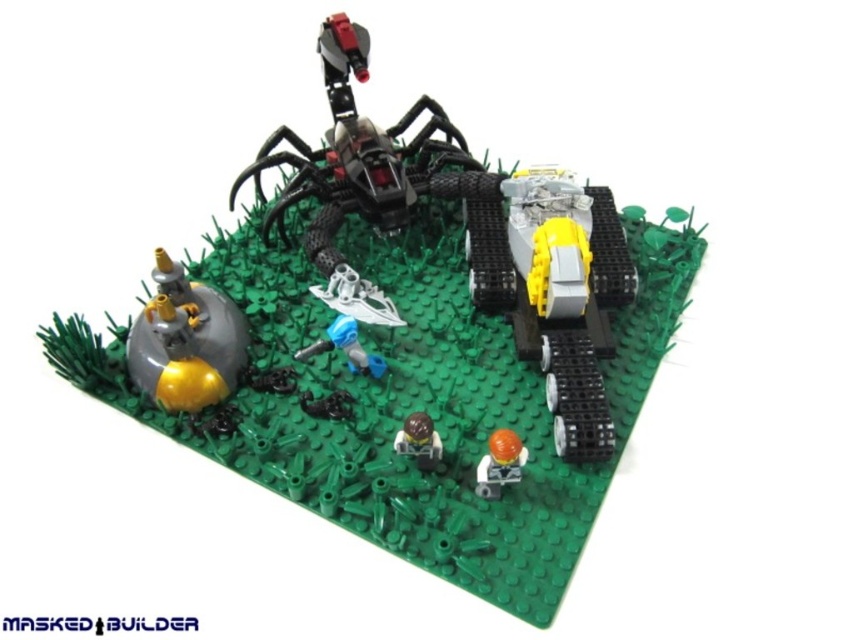
You are a LEGO designer trying to place both the orange matte minifigure at lower center and the brown matte minifigure at center into a new display. Based on their widths, which minifigure should you place first to ensure they fit properly?

The orange matte minifigure at lower center is wider than the brown matte minifigure at center, so you should place the orange matte minifigure at lower center first to ensure there is enough space for both.

You are a LEGO enthusiast examining the diorama and notice two minifigures. The orange matte minifigure at lower center and the brown matte minifigure at center. Which one is larger in size?

The orange matte minifigure at lower center is bigger than the brown matte minifigure at center.

You are a new minifigure joining the LEGO diorama. You need to stand exactly at the point marked at coordinate point [498,464]. Where should you position yourself in relation to the orange matte minifigure at lower center?

The point [498,464] is on the orange matte minifigure at lower center, so you should position yourself directly on top of the orange matte minifigure at lower center.